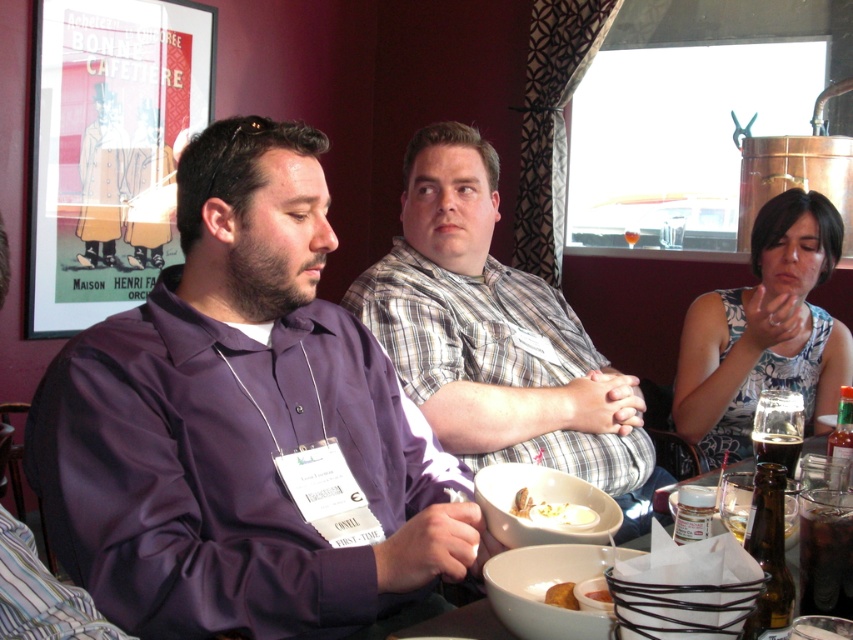
You are a photographer trying to capture a group photo of the plaid shirt at center and the white floral dress at upper right. Based on their positions, which subject should you focus on first to ensure they are both in frame?

The plaid shirt at center is positioned on the left side of white floral dress at upper right, so you should focus on the plaid shirt at center first to ensure both subjects are in frame.

From the picture: You are a photographer setting up a shot of the group. You need to ensure that the plaid shirt at center and the white floral dress at upper right are both visible in the frame. Given their sizes, which object should you position closer to the camera to maintain their visibility?

Since the plaid shirt at center is larger than the white floral dress at upper right, you should position the plaid shirt at center closer to the camera to ensure both are visible. This way, the larger object won